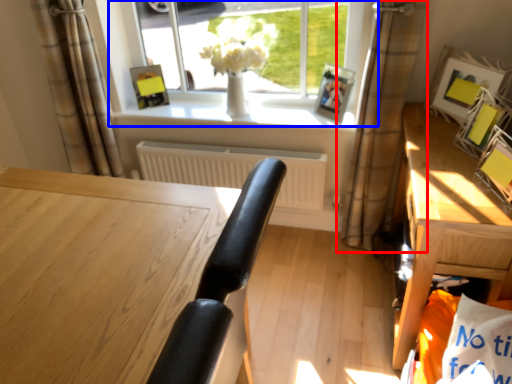
Question: Which point is closer to the camera, curtain (highlighted by a red box) or window (highlighted by a blue box)?

Choices:
 (A) curtain
 (B) window

Answer: (A)